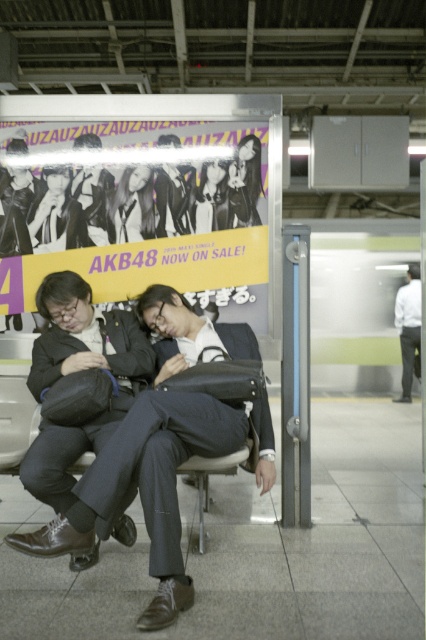
You are a photographer trying to capture a portrait of the person wearing the dark gray matte suit at center and the person with smooth black hair at center. To ensure both subjects are in focus, you need to know their relative sizes. Based on the scene, which object is wider?

The dark gray matte suit at center is wider than smooth black hair at center according to the description.

From the picture: You are a photographer trying to capture both the matte black jacket at upper left and the smooth skin face at center in a single frame. Given their sizes, which object should you focus on first to ensure both are in focus?

The matte black jacket at upper left is larger than the smooth skin face at center, so focusing on the matte black jacket at upper left first will help ensure both are in focus as it requires a closer attention due to its size.